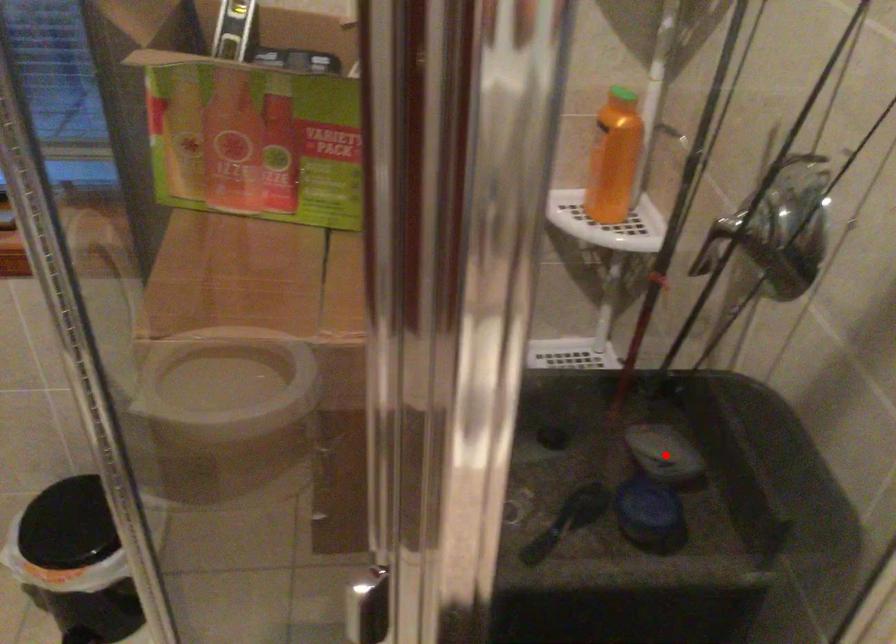
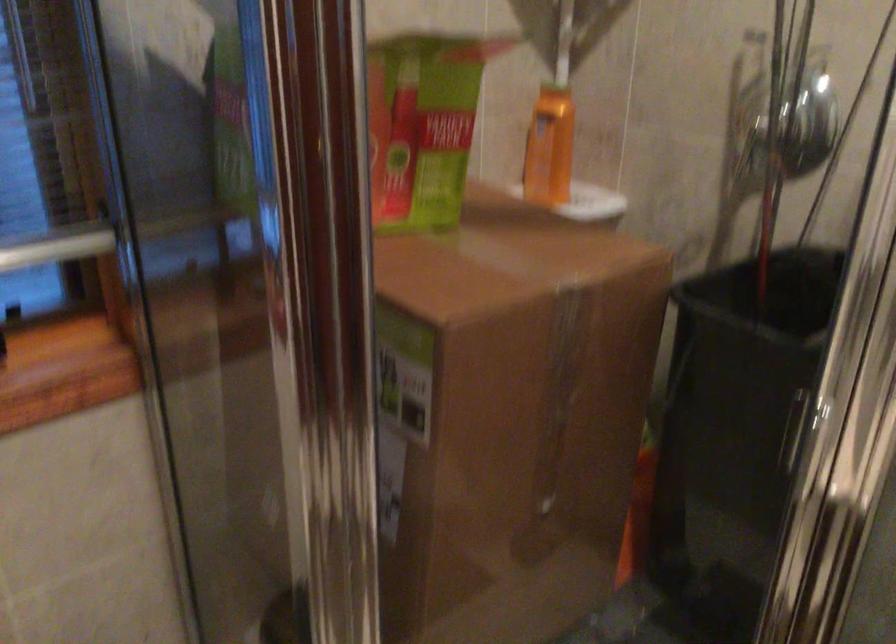
Question: I am providing you with two images of the same scene from different viewpoints. A red point is marked on the first image. At the location where the point appears in image 1, is it still visible in image 2?

Choices:
 (A) Yes
 (B) No

Answer: (B)